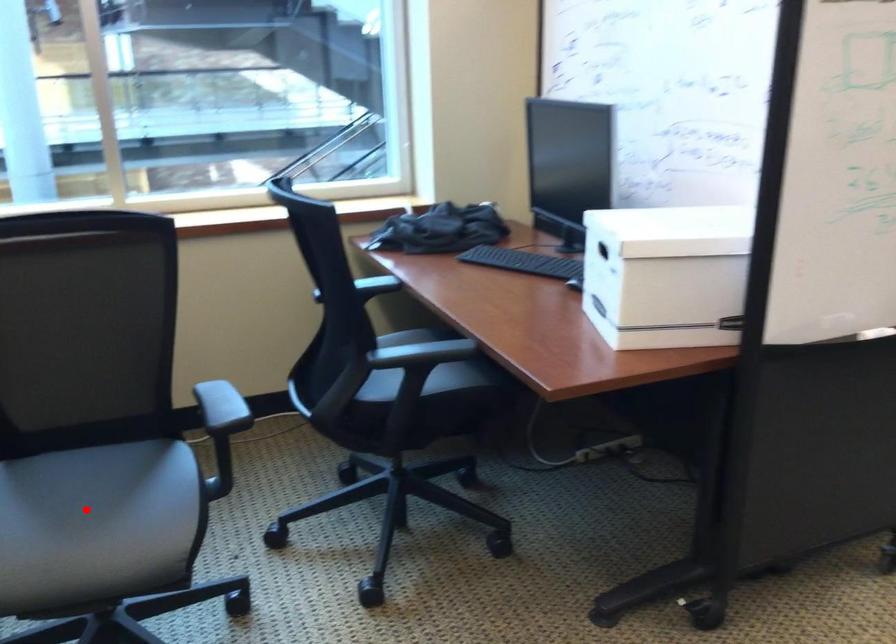
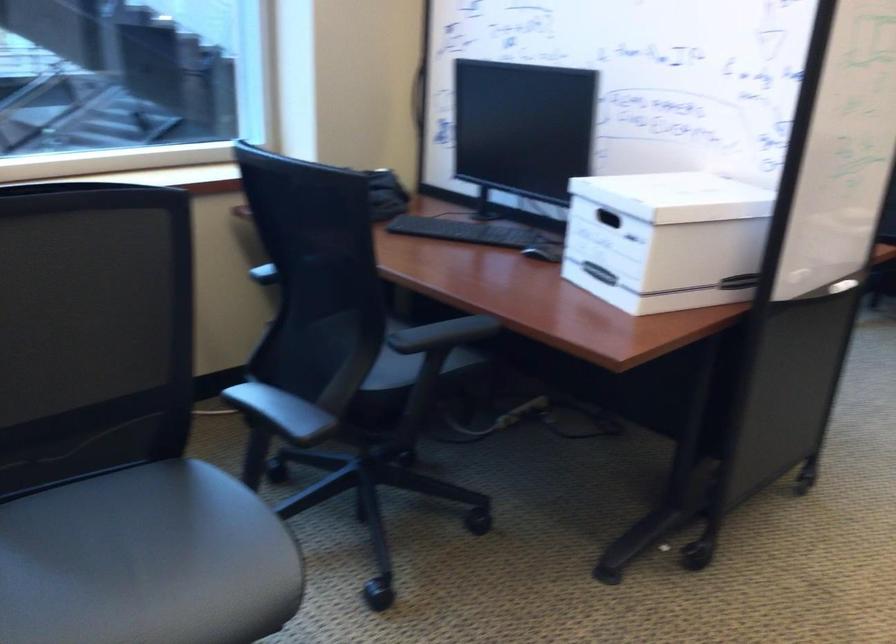
Question: I am providing you with two images of the same scene from different viewpoints. A red point is shown in image1. For the corresponding object point in image2, is it positioned nearer or farther from the camera?

Choices:
 (A) Nearer
 (B) Farther

Answer: (A)